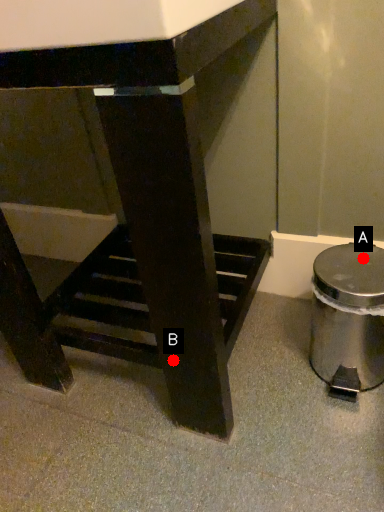
Question: Two points are circled on the image, labeled by A and B beside each circle. Which point is closer to the camera?

Choices:
 (A) A is closer
 (B) B is closer

Answer: (B)